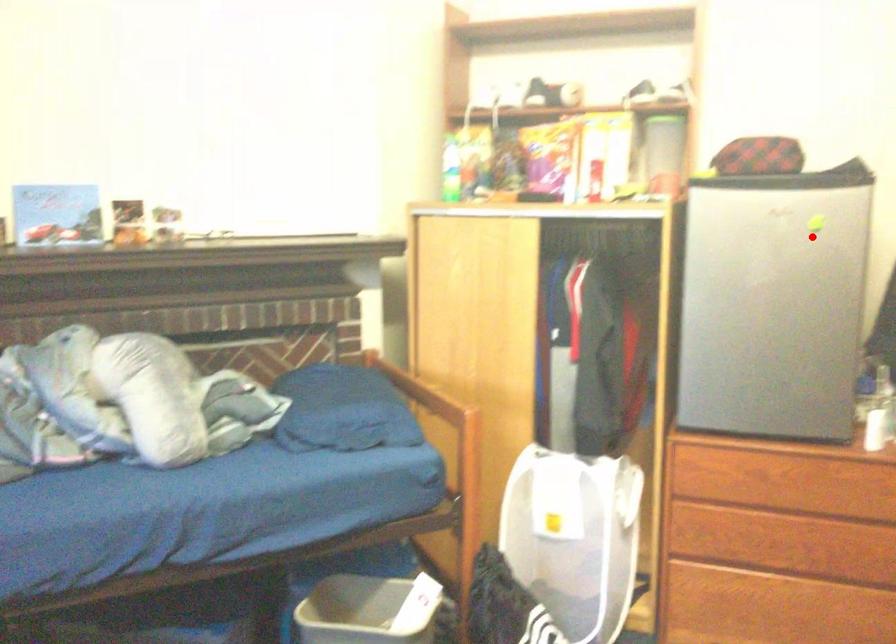
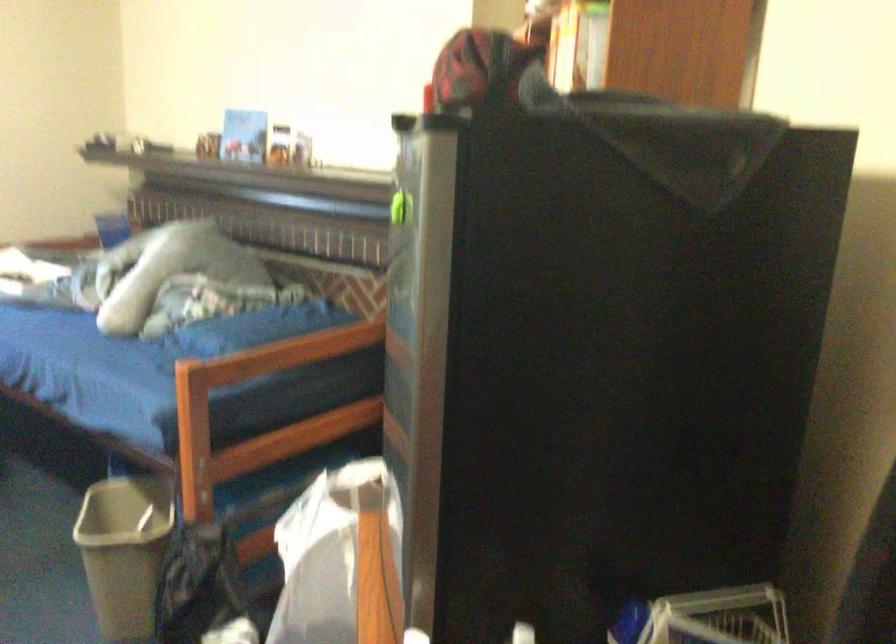
Question: I am providing you with two images of the same scene from different viewpoints. In image1, a red point is highlighted. Considering the same 3D point in image2, which of the following is correct?

Choices:
 (A) It is closer
 (B) It is farther

Answer: (A)